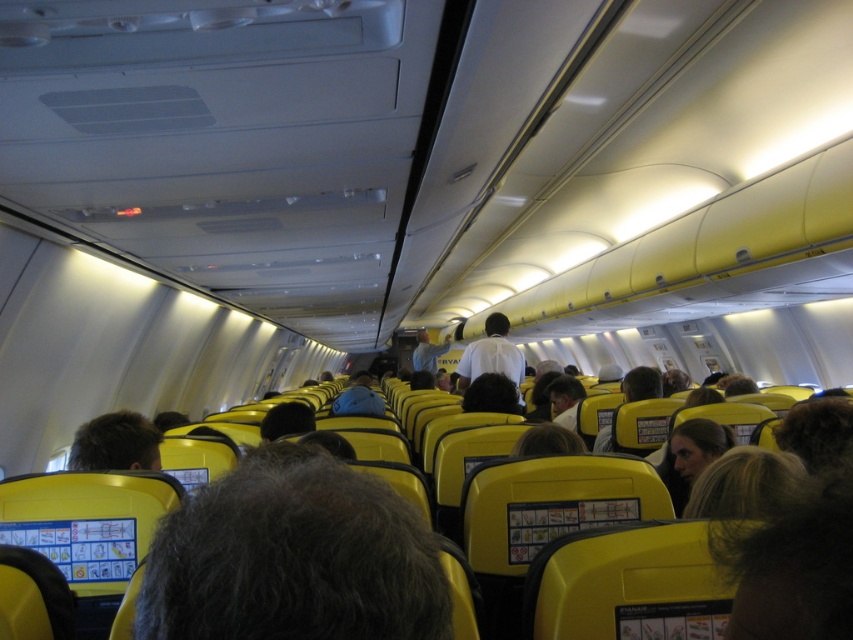
You are a passenger seated in the airplane cabin and want to reach a point in the cabin. You see two points labeled as point 1 and point 2. Point 1 is at coordinate point (76, 449) and point 2 is at coordinate point (457, 378). Which point is closer to you?

Point 1 is closer to you because it is closer to the viewer than point 2.

Consider the image. You are a flight attendant standing in the aisle of the airplane cabin. You need to hand out a safety pamphlet to both the dark brown hair at center and the white shirt at center. Which one should you hand the pamphlet to first if you want to reach them in order from shortest to tallest?

The dark brown hair at center is not as tall as white shirt at center, so you should hand the pamphlet to the dark brown hair at center first, then the white shirt at center.

You are a flight attendant standing in the aisle of the airplane cabin. You need to serve a passenger who has dark brown hair at center and another wearing a white shirt at center. Which passenger is closer to the left side of the aisle?

The dark brown hair at center is to the left of the white shirt at center, so the passenger with dark brown hair at center is closer to the left side of the aisle.